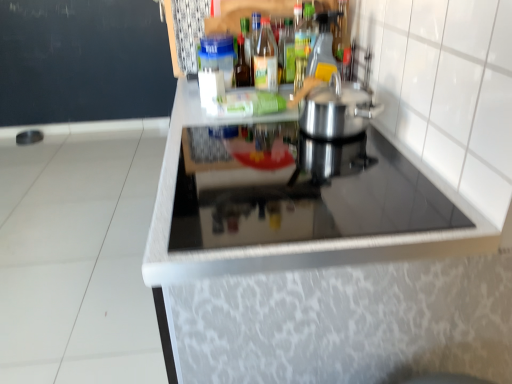
Question: Considering the positions of point (324, 185) and point (288, 79), is point (324, 185) closer or farther from the camera than point (288, 79)?

Choices:
 (A) farther
 (B) closer

Answer: (B)

Question: From their relative heights in the image, would you say black glass cooktop at center is taller or shorter than translucent glass bottle at upper center, which ranks as the fourth bottle in left-to-right order?

Choices:
 (A) tall
 (B) short

Answer: (B)

Question: Which object is the closest to the translucent glass bottle at upper center, which ranks as the fourth bottle in left-to-right order?

Choices:
 (A) satin silver pot at center
 (B) clear glass bottle at upper center, placed as the 3th bottle when sorted from right to left
 (C) translucent plastic bottle at upper center, which appears as the 2th bottle when viewed from the left
 (D) transparent glass bottle at upper center, which is the fifth bottle in left-to-right order
 (E) translucent glass bottle at center, which is counted as the 1th bottle, starting from the left

Answer: (B)

Question: Which of these objects is positioned farthest from the satin silver pot at center?

Choices:
 (A) black glass cooktop at center
 (B) clear glass bottle at upper center, placed as the 3th bottle when sorted from right to left
 (C) translucent glass bottle at upper center, which ranks as the fourth bottle in left-to-right order
 (D) translucent plastic bottle at upper center, the 4th bottle in the right-to-left sequence
 (E) translucent glass bottle at center, acting as the 5th bottle starting from the right

Answer: (E)